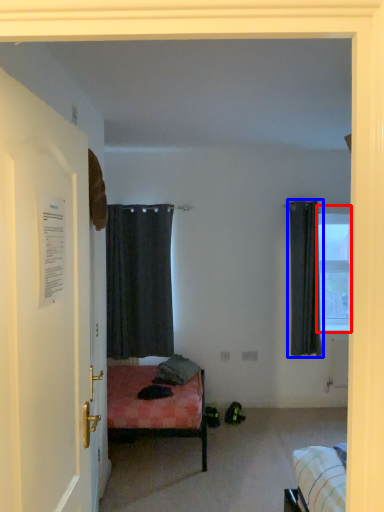
Question: Which of the following is the closest to the observer, window (highlighted by a red box) or curtain (highlighted by a blue box)?

Choices:
 (A) window
 (B) curtain

Answer: (B)